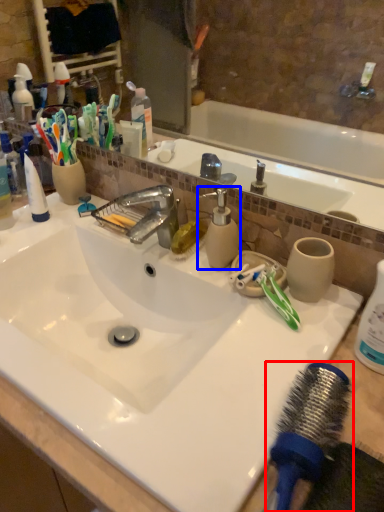
Question: Which point is closer to the camera, hair drier (highlighted by a red box) or soap dispenser (highlighted by a blue box)?

Choices:
 (A) hair drier
 (B) soap dispenser

Answer: (A)